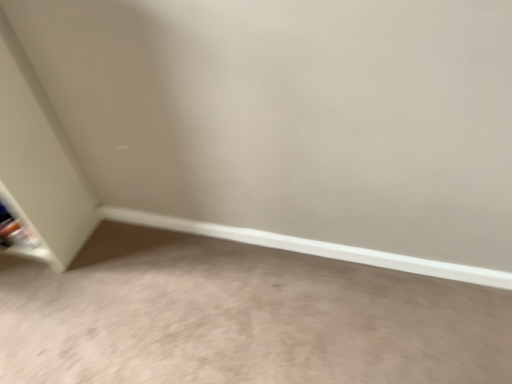
The image size is (512, 384). Describe the element at coordinates (241, 317) in the screenshot. I see `gray carpet at lower left` at that location.

This screenshot has width=512, height=384. I want to click on gray carpet at lower left, so click(x=241, y=317).

In order to face gray carpet at lower left, should I rotate leftwards or rightwards?

To face it directly, rotate left by 6.754 degrees.

This screenshot has height=384, width=512. Identify the location of metallic silver shelf at lower left. [x=22, y=233].

Describe the element at coordinates (22, 233) in the screenshot. This screenshot has height=384, width=512. I see `metallic silver shelf at lower left` at that location.

Image resolution: width=512 pixels, height=384 pixels. I want to click on gray carpet at lower left, so click(x=241, y=317).

Between gray carpet at lower left and metallic silver shelf at lower left, which one appears on the right side from the viewer's perspective?

gray carpet at lower left is more to the right.

Is gray carpet at lower left in front of or behind metallic silver shelf at lower left in the image?

Clearly, gray carpet at lower left is in front of metallic silver shelf at lower left.

Which point is more distant from viewer, (143, 264) or (39, 259)?

Positioned behind is point (39, 259).

From the image's perspective, is gray carpet at lower left below metallic silver shelf at lower left?

Yes, from the image's perspective, gray carpet at lower left is beneath metallic silver shelf at lower left.

From a real-world perspective, is gray carpet at lower left physically located above or below metallic silver shelf at lower left?

Clearly, from a real-world perspective, gray carpet at lower left is below metallic silver shelf at lower left.

Considering the relative sizes of gray carpet at lower left and metallic silver shelf at lower left in the image provided, is gray carpet at lower left wider than metallic silver shelf at lower left?

Correct, the width of gray carpet at lower left exceeds that of metallic silver shelf at lower left.

Which of these two, gray carpet at lower left or metallic silver shelf at lower left, stands taller?

metallic silver shelf at lower left is taller.

Which of these two, gray carpet at lower left or metallic silver shelf at lower left, is bigger?

Bigger between the two is gray carpet at lower left.

Is gray carpet at lower left outside of metallic silver shelf at lower left?

gray carpet at lower left is positioned outside metallic silver shelf at lower left.

Are gray carpet at lower left and metallic silver shelf at lower left located far from each other?

They are positioned close to each other.

Is metallic silver shelf at lower left at the back of gray carpet at lower left?

No, gray carpet at lower left's orientation is not away from metallic silver shelf at lower left.

What's the angular difference between gray carpet at lower left and metallic silver shelf at lower left's facing directions?

The angular difference between gray carpet at lower left and metallic silver shelf at lower left is 90.4 degrees.

Find the location of a particular element. This screenshot has height=384, width=512. concrete on the right of metallic silver shelf at lower left is located at coordinates (241, 317).

Does metallic silver shelf at lower left appear on the left side of gray carpet at lower left?

Indeed, metallic silver shelf at lower left is positioned on the left side of gray carpet at lower left.

Between metallic silver shelf at lower left and gray carpet at lower left, which one is positioned behind?

metallic silver shelf at lower left is behind.

Which is in front, point (26, 224) or point (20, 330)?

The point (20, 330) is in front.

From the image's perspective, which is above, metallic silver shelf at lower left or gray carpet at lower left?

metallic silver shelf at lower left, from the image's perspective.

From a real-world perspective, is metallic silver shelf at lower left below gray carpet at lower left?

No, from a real-world perspective, metallic silver shelf at lower left is not below gray carpet at lower left.

Can you confirm if metallic silver shelf at lower left is thinner than gray carpet at lower left?

Indeed, metallic silver shelf at lower left has a lesser width compared to gray carpet at lower left.

Can you confirm if metallic silver shelf at lower left is shorter than gray carpet at lower left?

Incorrect, the height of metallic silver shelf at lower left does not fall short of that of gray carpet at lower left.

Who is bigger, metallic silver shelf at lower left or gray carpet at lower left?

gray carpet at lower left is bigger.

Looking at this image, choose the correct answer: Is metallic silver shelf at lower left inside gray carpet at lower left or outside it?

metallic silver shelf at lower left cannot be found inside gray carpet at lower left.

Is there a large distance between metallic silver shelf at lower left and gray carpet at lower left?

No, metallic silver shelf at lower left is not far from gray carpet at lower left.

Is metallic silver shelf at lower left facing towards gray carpet at lower left?

No, metallic silver shelf at lower left is not facing towards gray carpet at lower left.

The height and width of the screenshot is (384, 512). In order to click on shelf above the gray carpet at lower left (from the image's perspective) in this screenshot , I will do `click(22, 233)`.

Where is `concrete directly beneath the metallic silver shelf at lower left (from a real-world perspective)`? The height and width of the screenshot is (384, 512). concrete directly beneath the metallic silver shelf at lower left (from a real-world perspective) is located at coordinates click(x=241, y=317).

This screenshot has height=384, width=512. In order to click on shelf on the left of gray carpet at lower left in this screenshot , I will do `click(22, 233)`.